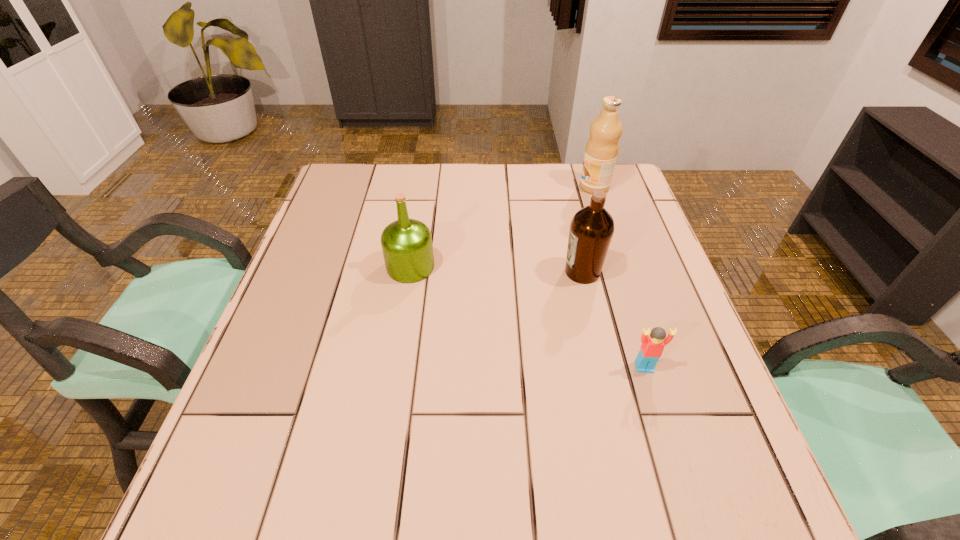
Locate an element on the screen. This screenshot has height=540, width=960. vacant space at the right edge of the desktop is located at coordinates click(614, 298).

In the image, there is a desktop. At what (x,y) coordinates should I click in order to perform the action: click on free space at the far left corner. Please return your answer as a coordinate pair (x, y). The height and width of the screenshot is (540, 960). Looking at the image, I should click on (350, 205).

This screenshot has height=540, width=960. In the image, there is a desktop. Find the location of `vacant space at the near left corner`. vacant space at the near left corner is located at coordinates (296, 485).

Locate an element on the screen. Image resolution: width=960 pixels, height=540 pixels. free point between the second olive oil from left to right and the leftmost olive oil is located at coordinates (496, 269).

Identify the location of free spot between the leftmost olive oil and the second olive oil from left to right. The height and width of the screenshot is (540, 960). (496, 269).

Find the location of a particular element. free space between the leftmost object and the second olive oil from left to right is located at coordinates (496, 269).

Locate an element on the screen. The width and height of the screenshot is (960, 540). vacant region between the tallest object and the leftmost olive oil is located at coordinates (502, 227).

Where is `vacant space that is in between the second olive oil from right to left and the leftmost object`? The height and width of the screenshot is (540, 960). vacant space that is in between the second olive oil from right to left and the leftmost object is located at coordinates (496, 269).

I want to click on empty space that is in between the shortest object and the farthest olive oil, so click(x=619, y=277).

Locate an element on the screen. The height and width of the screenshot is (540, 960). free space between the leftmost olive oil and the third object from right to left is located at coordinates (496, 269).